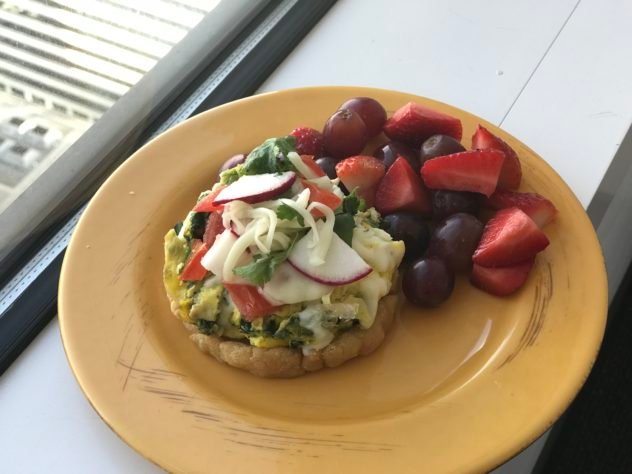
The height and width of the screenshot is (474, 632). Find the location of `window frame`. window frame is located at coordinates (27, 306).